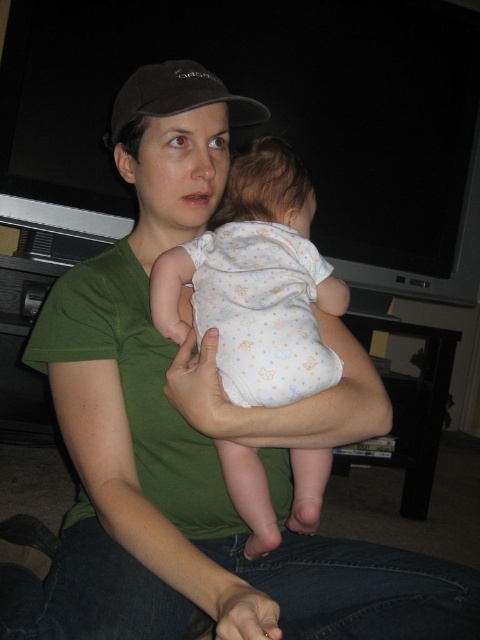
You are a photographer trying to capture the woman and baby in the image. You want to ensure the white dotted fabric at center and the black fabric baseball cap at upper center are both clearly visible in your photo. Which object should you focus on first to ensure both are in focus?

The white dotted fabric at center is in front of the black fabric baseball cap at upper center. To ensure both are in focus, you should focus on the black fabric baseball cap at upper center first since it is further away from the camera, and the white dotted fabric at center will naturally be in focus as it is closer.

You are a tailor who needs to determine which fabric is more suitable for making a new hat. Based on the image, which fabric between the white dotted fabric at center and the black fabric baseball cap at upper center is thinner?

The white dotted fabric at center is thinner than the black fabric baseball cap at upper center, so it would be more suitable for making a new hat.

You are standing in front of the image and want to touch the two points shown in the scene. Which point, point (190, 276) or point (111, 138), would require you to reach out further to touch it?

Point (111, 138) would require reaching out further because it is farther from the viewer compared to point (190, 276).